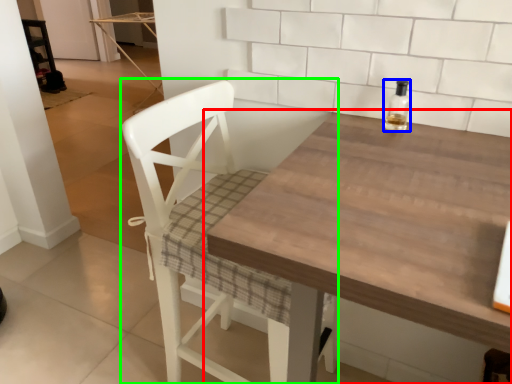
Question: Which is nearer to the table (highlighted by a red box)? bottle (highlighted by a blue box) or chair (highlighted by a green box).

Choices:
 (A) bottle
 (B) chair

Answer: (B)